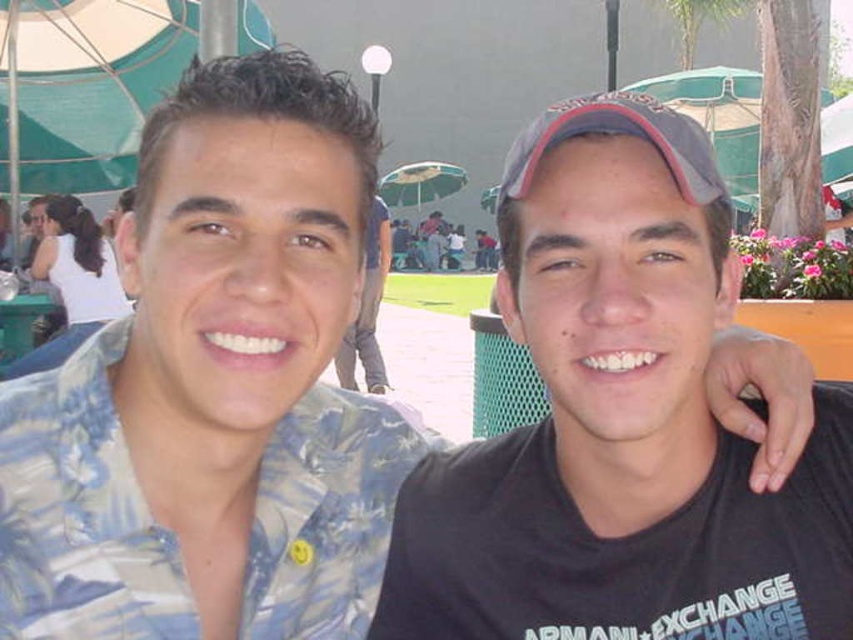
Question: Observing the image, what is the correct spatial positioning of black matte cap at center in reference to matte blue shirt at center?

Choices:
 (A) above
 (B) below

Answer: (A)

Question: Does black matte cap at center appear on the right side of matte blue shirt at center?

Choices:
 (A) yes
 (B) no

Answer: (A)

Question: Which of the following is the closest to the observer?

Choices:
 (A) click(x=370, y=282)
 (B) click(x=416, y=582)

Answer: (B)

Question: Is black matte cap at center below matte blue shirt at center?

Choices:
 (A) no
 (B) yes

Answer: (A)